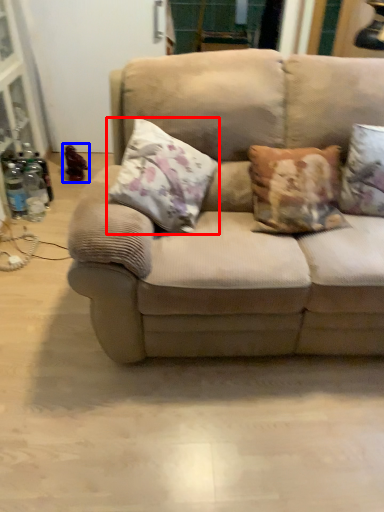
Question: Which object appears closest to the camera in this image, pillow (highlighted by a red box) or toy (highlighted by a blue box)?

Choices:
 (A) pillow
 (B) toy

Answer: (A)